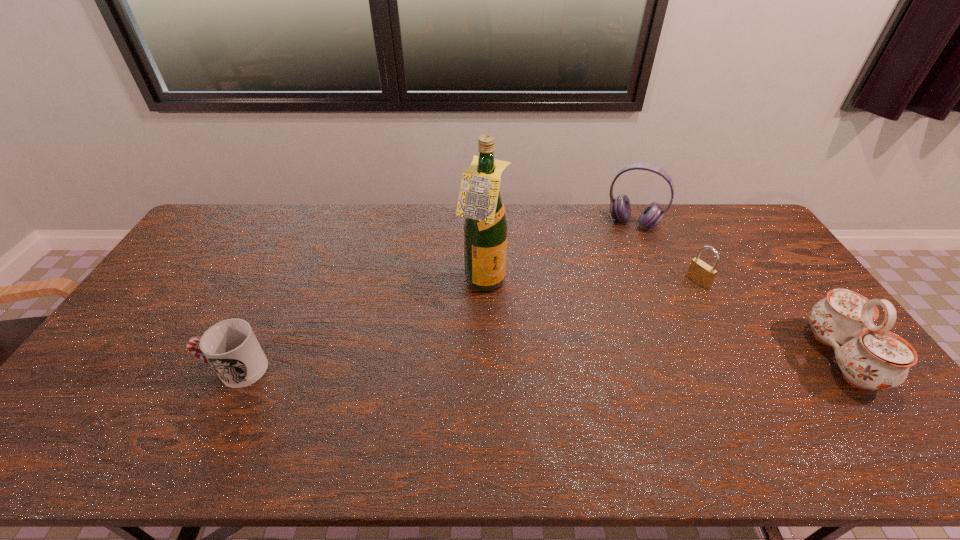
Locate an element on the screen. This screenshot has width=960, height=540. free spot at the far left corner of the desktop is located at coordinates (245, 213).

Find the location of a particular element. The image size is (960, 540). empty location between the fourth object from right to left and the leftmost object is located at coordinates (359, 326).

Where is `free area in between the padlock and the rightmost object`? This screenshot has height=540, width=960. free area in between the padlock and the rightmost object is located at coordinates (769, 319).

Where is `free space between the liquor and the leftmost object`? This screenshot has height=540, width=960. free space between the liquor and the leftmost object is located at coordinates (359, 326).

Where is `free spot between the chinaware and the cup`? Image resolution: width=960 pixels, height=540 pixels. free spot between the chinaware and the cup is located at coordinates (539, 363).

At what (x,y) coordinates should I click in order to perform the action: click on vacant space in between the leftmost object and the rightmost object. Please return your answer as a coordinate pair (x, y). Looking at the image, I should click on (539, 363).

I want to click on vacant point located between the second object from left to right and the leftmost object, so click(359, 326).

Find the location of `empty space between the leftmost object and the rightmost object`. empty space between the leftmost object and the rightmost object is located at coordinates (539, 363).

Where is `vacant area that lies between the headset and the cup`? Image resolution: width=960 pixels, height=540 pixels. vacant area that lies between the headset and the cup is located at coordinates (434, 296).

This screenshot has width=960, height=540. Find the location of `unoccupied area between the padlock and the rightmost object`. unoccupied area between the padlock and the rightmost object is located at coordinates pos(769,319).